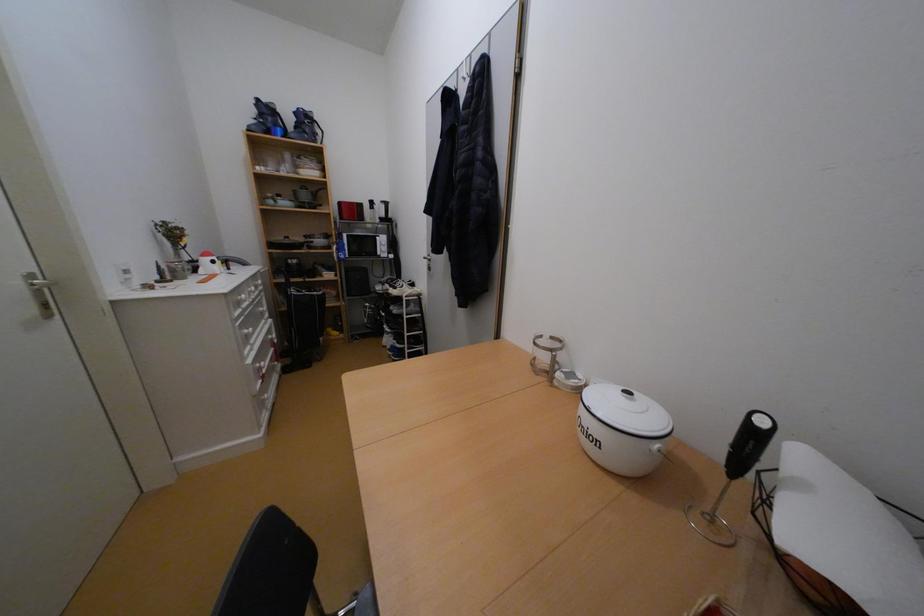
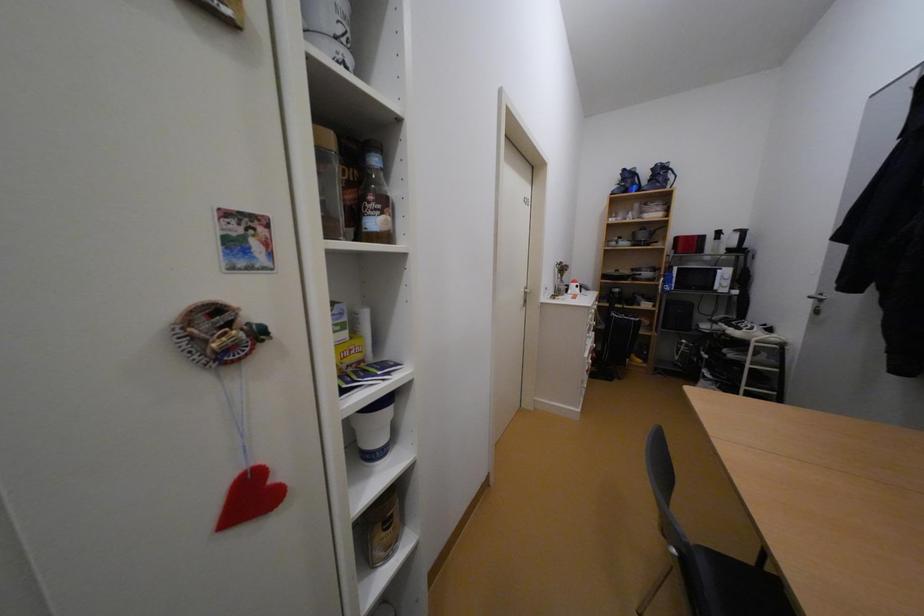
Question: The first image is from the beginning of the video and the second image is from the end. How did the camera likely rotate when shooting the video?

Choices:
 (A) Left
 (B) Right
 (C) Up
 (D) Down

Answer: (A)